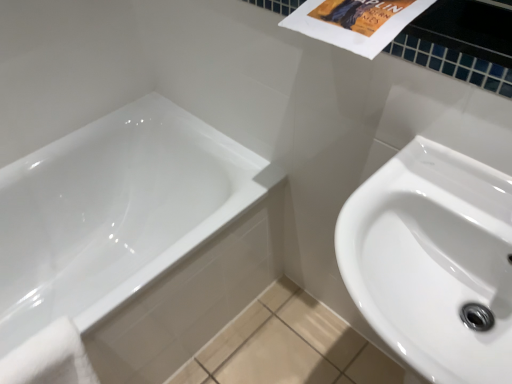
Question: Can you confirm if white soft towel at lower left is bigger than white glossy bathtub at lower left?

Choices:
 (A) no
 (B) yes

Answer: (A)

Question: From the image's perspective, would you say white soft towel at lower left is positioned over white glossy bathtub at lower left?

Choices:
 (A) no
 (B) yes

Answer: (A)

Question: From the image's perspective, would you say white soft towel at lower left is shown under white glossy bathtub at lower left?

Choices:
 (A) yes
 (B) no

Answer: (A)

Question: Is white soft towel at lower left turned away from white glossy bathtub at lower left?

Choices:
 (A) yes
 (B) no

Answer: (A)

Question: Is white glossy bathtub at lower left completely or partially inside white soft towel at lower left?

Choices:
 (A) no
 (B) yes

Answer: (A)

Question: From the image's perspective, is white glossy sink at right positioned above or below white soft towel at lower left?

Choices:
 (A) below
 (B) above

Answer: (B)

Question: Is white glossy sink at right inside the boundaries of white soft towel at lower left, or outside?

Choices:
 (A) inside
 (B) outside

Answer: (B)

Question: From a real-world perspective, is white glossy sink at right above or below white soft towel at lower left?

Choices:
 (A) above
 (B) below

Answer: (A)

Question: In terms of height, does white glossy sink at right look taller or shorter compared to white soft towel at lower left?

Choices:
 (A) short
 (B) tall

Answer: (B)

Question: Is point (173, 327) positioned closer to the camera than point (84, 360)?

Choices:
 (A) closer
 (B) farther

Answer: (B)

Question: Is white glossy bathtub at lower left taller or shorter than white soft towel at lower left?

Choices:
 (A) tall
 (B) short

Answer: (A)

Question: In the image, is white glossy bathtub at lower left on the left side or the right side of white soft towel at lower left?

Choices:
 (A) right
 (B) left

Answer: (B)

Question: Is white glossy bathtub at lower left in front of or behind white soft towel at lower left in the image?

Choices:
 (A) behind
 (B) front

Answer: (A)

Question: Would you say white soft towel at lower left is inside or outside white glossy sink at right?

Choices:
 (A) outside
 (B) inside

Answer: (A)

Question: In terms of width, does white soft towel at lower left look wider or thinner when compared to white glossy sink at right?

Choices:
 (A) wide
 (B) thin

Answer: (B)